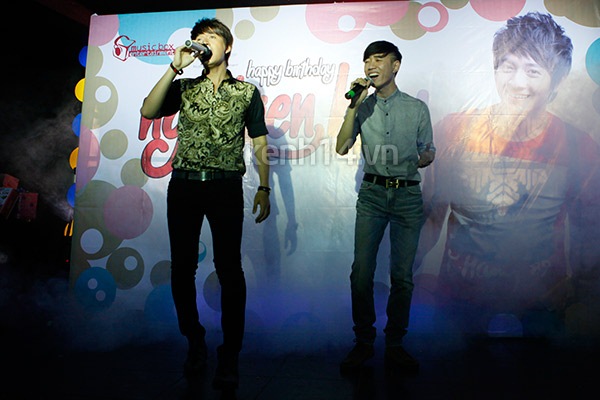
Where is `picture`? This screenshot has width=600, height=400. picture is located at coordinates (521, 131).